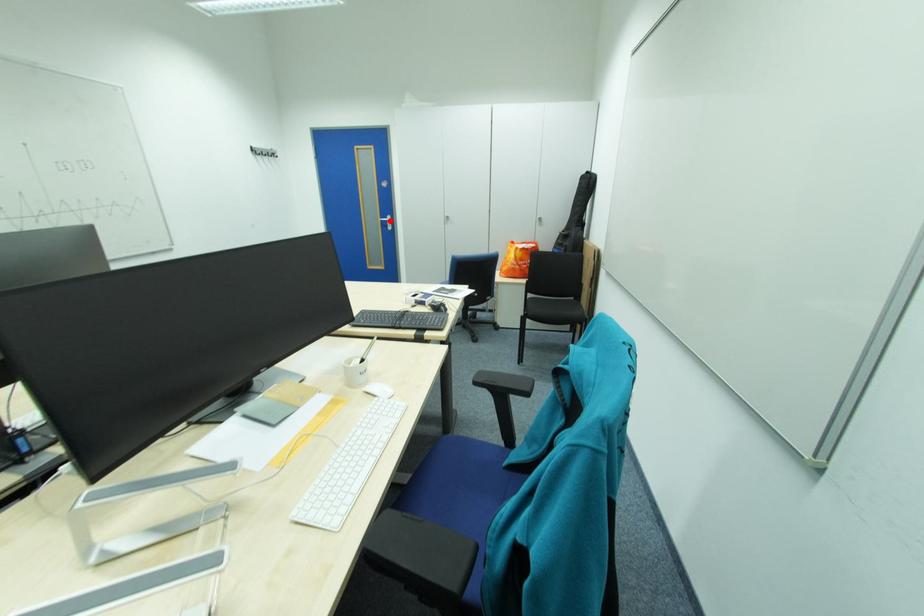
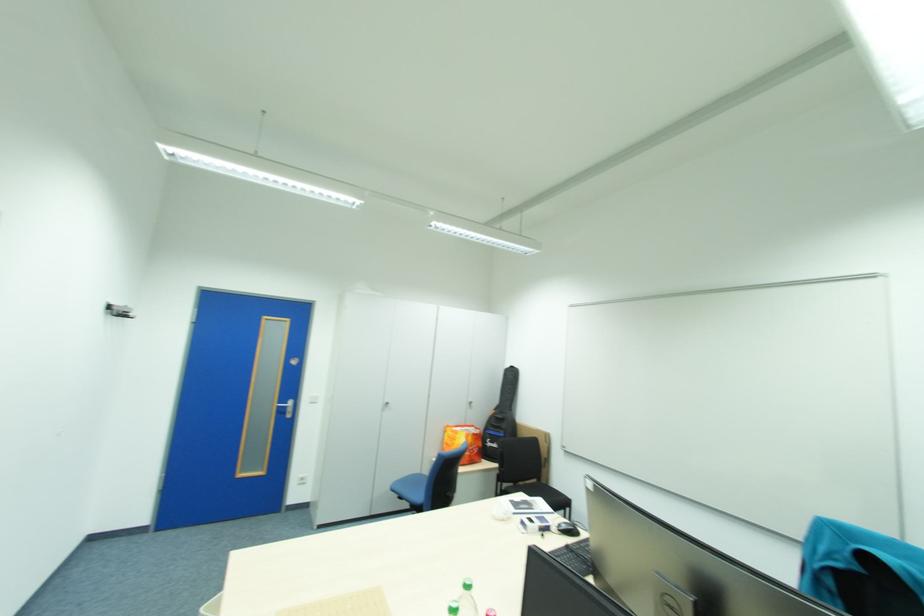
Find the pixel in the second image that matches the highlighted location in the first image.

(286, 407)